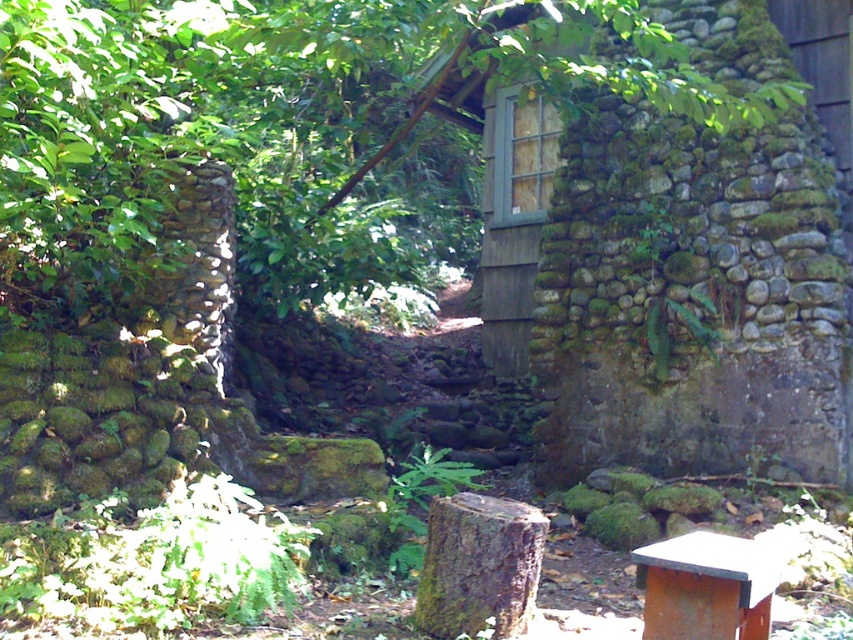
From the picture: Can you confirm if mossy bark stump at center is smaller than rusty metal beehive at lower right?

No, mossy bark stump at center is not smaller than rusty metal beehive at lower right.

The image size is (853, 640). Describe the element at coordinates (479, 564) in the screenshot. I see `mossy bark stump at center` at that location.

Identify the location of mossy bark stump at center. (479, 564).